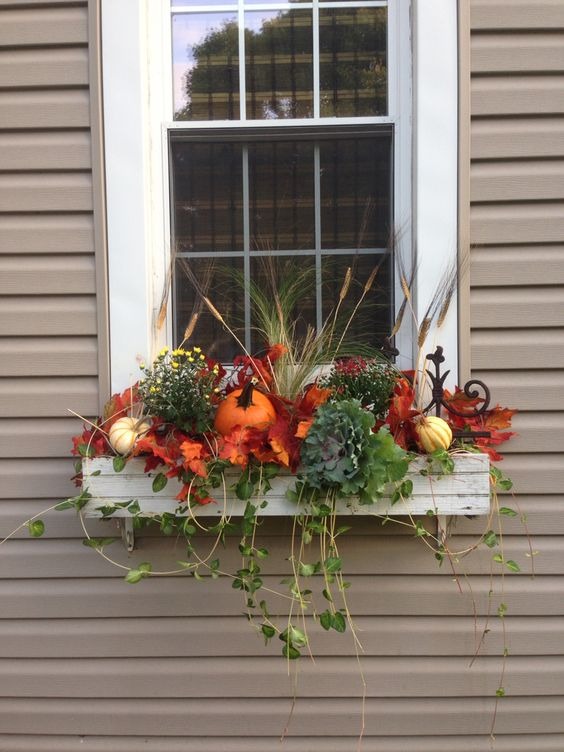
The height and width of the screenshot is (752, 564). In order to click on trailing green vine like plant in this screenshot , I will do `click(293, 632)`, `click(249, 487)`, `click(442, 459)`.